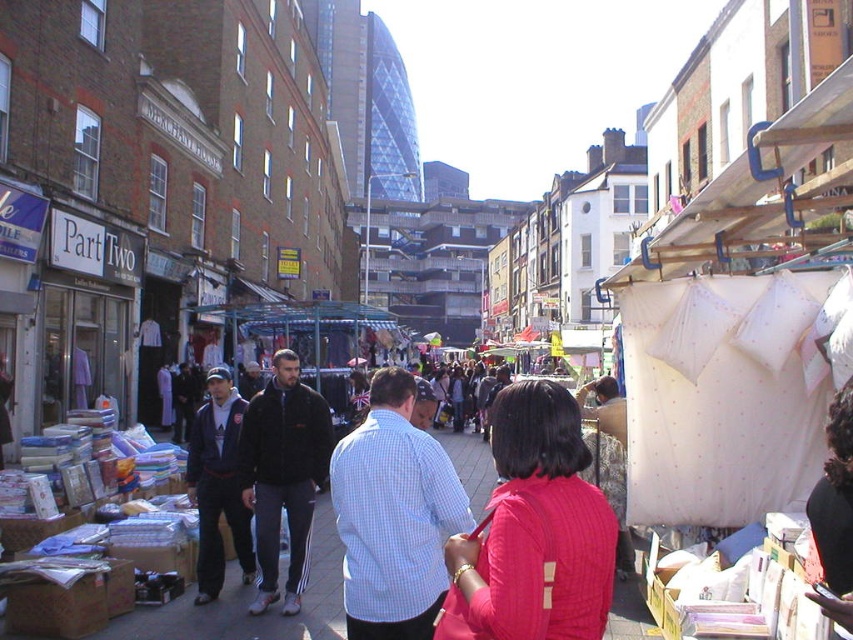
Who is positioned more to the right, ribbed pink sweater at center or light blue checkered shirt at center?

ribbed pink sweater at center is more to the right.

Based on the photo, who is more forward, (497, 634) or (405, 429)?

Point (497, 634)

The height and width of the screenshot is (640, 853). In order to click on ribbed pink sweater at center in this screenshot , I will do `click(532, 531)`.

Is light blue checkered shirt at center positioned before black fleece jacket at center?

A: Yes, it is.

The height and width of the screenshot is (640, 853). I want to click on light blue checkered shirt at center, so click(393, 515).

At what (x,y) coordinates should I click in order to perform the action: click on light blue checkered shirt at center. Please return your answer as a coordinate pair (x, y). The width and height of the screenshot is (853, 640). Looking at the image, I should click on (393, 515).

Is point (573, 612) positioned behind point (196, 554)?

No, it is in front of (196, 554).

Does ribbed pink sweater at center have a lesser height compared to dark blue jacket at center?

Correct, ribbed pink sweater at center is not as tall as dark blue jacket at center.

Is point (498, 433) in front of point (241, 509)?

Yes, point (498, 433) is in front of point (241, 509).

Where is `ribbed pink sweater at center`? The height and width of the screenshot is (640, 853). ribbed pink sweater at center is located at coordinates (532, 531).